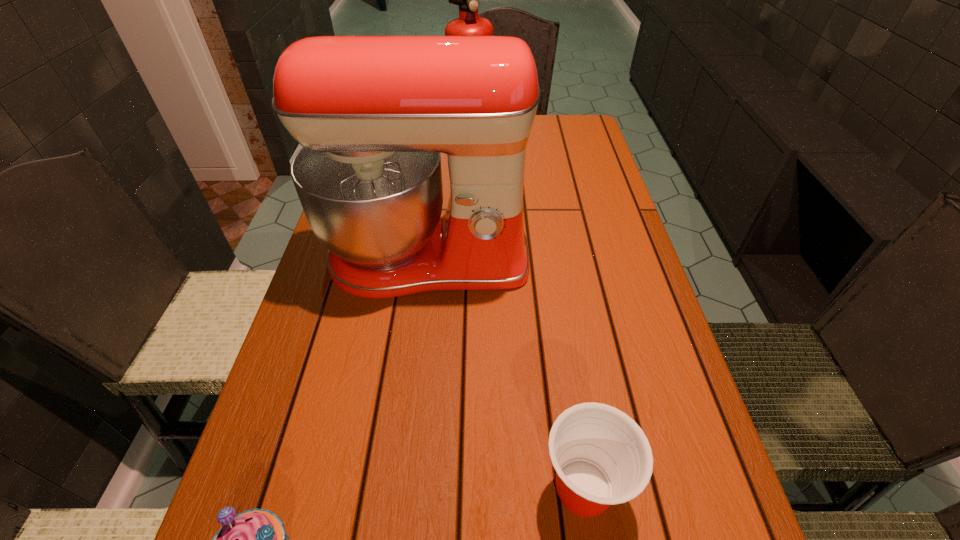
Where is `the farthest object`? the farthest object is located at coordinates (468, 23).

Where is `mixer`? mixer is located at coordinates (373, 113).

The width and height of the screenshot is (960, 540). I want to click on the second shortest object, so click(x=601, y=456).

Identify the location of vacant region located 0.130m on the front-facing side of the farthest object. The image size is (960, 540). (480, 187).

Locate an element on the screen. free region located on the front-facing side of the second farthest object is located at coordinates (416, 357).

Locate an element on the screen. This screenshot has width=960, height=540. blank space located 0.220m on the left of the cup is located at coordinates (396, 488).

Where is `object that is at the far edge`? object that is at the far edge is located at coordinates (468, 23).

The width and height of the screenshot is (960, 540). I want to click on object present at the left edge, so click(373, 113).

I want to click on object positioned at the right edge, so click(x=601, y=456).

At what (x,y) coordinates should I click in order to perform the action: click on free space at the right edge. Please return your answer as a coordinate pair (x, y). Looking at the image, I should click on (664, 537).